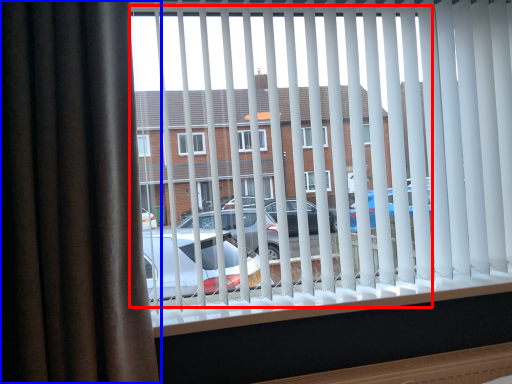
Question: Which of the following is the farthest to the observer, bay window (highlighted by a red box) or curtain (highlighted by a blue box)?

Choices:
 (A) bay window
 (B) curtain

Answer: (A)